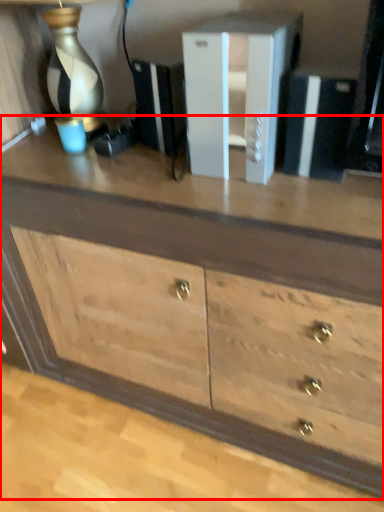
Question: From the image's perspective, what is the correct spatial positioning of chest of drawers (annotated by the red box) in reference to file cabinet?

Choices:
 (A) below
 (B) above

Answer: (A)